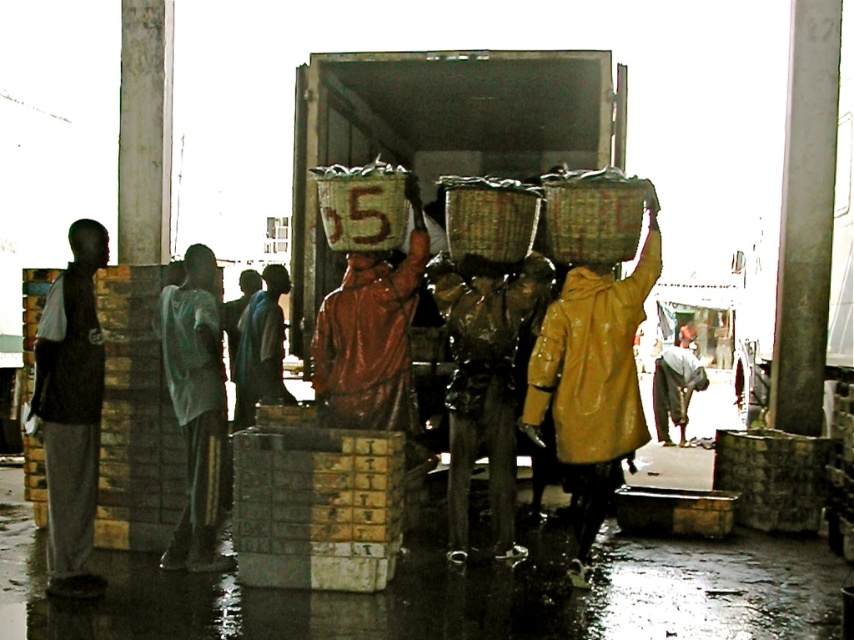
Is matte brown head at center shorter than smooth brown head at center?

Correct, matte brown head at center is not as tall as smooth brown head at center.

Does matte brown head at center have a greater width compared to smooth brown head at center?

No, matte brown head at center is not wider than smooth brown head at center.

This screenshot has height=640, width=854. What are the coordinates of `matte brown head at center` in the screenshot? It's located at (481, 272).

Does shiny plastic head at center come behind shiny orange helmet at center?

That is True.

Does shiny plastic head at center appear on the right side of shiny orange helmet at center?

Yes, shiny plastic head at center is to the right of shiny orange helmet at center.

Is point (541, 285) closer to camera compared to point (363, 252)?

No, (541, 285) is behind (363, 252).

Locate an element on the screen. The width and height of the screenshot is (854, 640). shiny plastic head at center is located at coordinates (533, 276).

Which is below, dark gray pants at left or shiny orange helmet at center?

dark gray pants at left

Who is more distant from viewer, (47, 481) or (370, 268)?

The point (370, 268) is behind.

The width and height of the screenshot is (854, 640). What are the coordinates of `dark gray pants at left` in the screenshot? It's located at (71, 410).